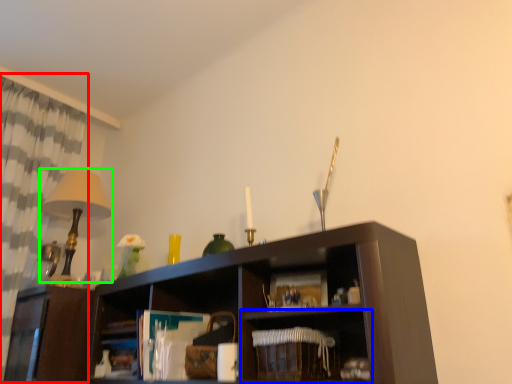
Question: Which is nearer to the curtain (highlighted by a red box)? shelf (highlighted by a blue box) or table lamp (highlighted by a green box).

Choices:
 (A) shelf
 (B) table lamp

Answer: (B)